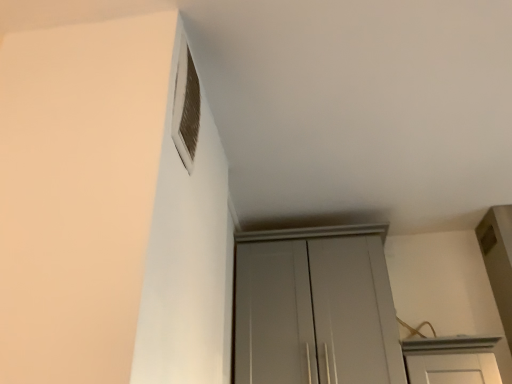
Describe the element at coordinates (186, 108) in the screenshot. I see `white textured vent at upper left` at that location.

Locate an element on the screen. The image size is (512, 384). white textured vent at upper left is located at coordinates (186, 108).

What do you see at coordinates (315, 309) in the screenshot? I see `matte gray cupboard at center` at bounding box center [315, 309].

Where is `matte gray cupboard at center`? This screenshot has width=512, height=384. matte gray cupboard at center is located at coordinates pos(315,309).

Find the location of `white textured vent at upper left`. white textured vent at upper left is located at coordinates (186, 108).

Considering the positions of objects white textured vent at upper left and matte gray cupboard at center in the image provided, who is more to the left, white textured vent at upper left or matte gray cupboard at center?

white textured vent at upper left.

From the picture: Which object is further away from the camera, white textured vent at upper left or matte gray cupboard at center?

matte gray cupboard at center is behind.

Is point (184, 47) in front of point (316, 284)?

Yes.

From the image's perspective, which one is positioned lower, white textured vent at upper left or matte gray cupboard at center?

matte gray cupboard at center appears lower in the image.

In the scene shown: From a real-world perspective, is white textured vent at upper left beneath matte gray cupboard at center?

No.

Which object is wider, white textured vent at upper left or matte gray cupboard at center?

matte gray cupboard at center is wider.

Between white textured vent at upper left and matte gray cupboard at center, which one has less height?

With less height is white textured vent at upper left.

Based on their sizes in the image, would you say white textured vent at upper left is bigger or smaller than matte gray cupboard at center?

Clearly, white textured vent at upper left is smaller in size than matte gray cupboard at center.

Is matte gray cupboard at center inside white textured vent at upper left?

Actually, matte gray cupboard at center is outside white textured vent at upper left.

Is white textured vent at upper left next to matte gray cupboard at center and touching it?

No, white textured vent at upper left is not touching matte gray cupboard at center.

Could you tell me if white textured vent at upper left is turned towards matte gray cupboard at center?

No, white textured vent at upper left is not facing towards matte gray cupboard at center.

What's the angular difference between white textured vent at upper left and matte gray cupboard at center's facing directions?

There is a 90.8-degree angle between the facing directions of white textured vent at upper left and matte gray cupboard at center.

How far apart are white textured vent at upper left and matte gray cupboard at center?

white textured vent at upper left and matte gray cupboard at center are 35.12 inches apart from each other.

The width and height of the screenshot is (512, 384). Identify the location of window in front of the matte gray cupboard at center. (186, 108).

Considering the positions of objects matte gray cupboard at center and white textured vent at upper left in the image provided, who is more to the right, matte gray cupboard at center or white textured vent at upper left?

From the viewer's perspective, matte gray cupboard at center appears more on the right side.

Is the depth of matte gray cupboard at center greater than that of white textured vent at upper left?

Yes, it is behind white textured vent at upper left.

Is point (351, 301) positioned behind point (184, 103)?

That is True.

From the image's perspective, is matte gray cupboard at center on top of white textured vent at upper left?

Incorrect, from the image's perspective, matte gray cupboard at center is lower than white textured vent at upper left.

From a real-world perspective, which is physically above, matte gray cupboard at center or white textured vent at upper left?

In real-world perspective, white textured vent at upper left is above.

Considering the relative sizes of matte gray cupboard at center and white textured vent at upper left in the image provided, is matte gray cupboard at center wider than white textured vent at upper left?

Yes.

Is matte gray cupboard at center taller than white textured vent at upper left?

Correct, matte gray cupboard at center is much taller as white textured vent at upper left.

Who is smaller, matte gray cupboard at center or white textured vent at upper left?

Smaller between the two is white textured vent at upper left.

Is matte gray cupboard at center completely or partially outside of white textured vent at upper left?

Indeed, matte gray cupboard at center is completely outside white textured vent at upper left.

Is matte gray cupboard at center beside white textured vent at upper left?

matte gray cupboard at center is not next to white textured vent at upper left, and they're not touching.

Is matte gray cupboard at center facing away from white textured vent at upper left?

That's not correct — matte gray cupboard at center is not looking away from white textured vent at upper left.

You are a GUI agent. You are given a task and a screenshot of the screen. Output one action in this format:
    pyautogui.click(x=<x>, y=<y>)
    Task: Click on the cupboard behind the white textured vent at upper left
    This screenshot has height=384, width=512.
    Given the screenshot: What is the action you would take?
    pyautogui.click(x=315, y=309)

Identify the location of window lying in front of the matte gray cupboard at center. The image size is (512, 384). (186, 108).

This screenshot has width=512, height=384. Identify the location of window on the left side of matte gray cupboard at center. (186, 108).